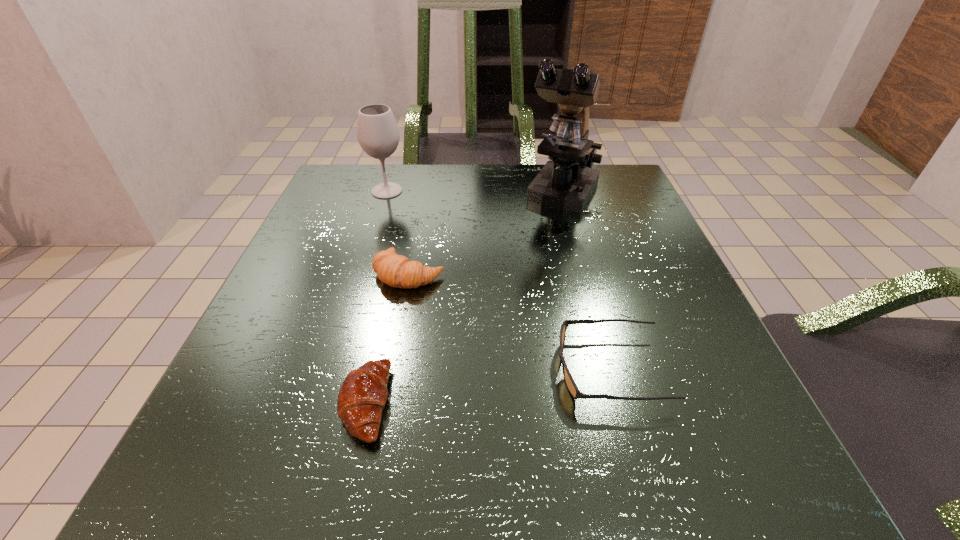
Where is `free area in between the sunglasses and the nearer crescent roll`? This screenshot has height=540, width=960. free area in between the sunglasses and the nearer crescent roll is located at coordinates (488, 386).

Locate an element on the screen. free space between the nearer crescent roll and the fourth shortest object is located at coordinates (376, 297).

Identify the location of free space between the wineglass and the nearer crescent roll. (376, 297).

This screenshot has width=960, height=540. Identify the location of unoccupied position between the sunglasses and the wineglass. (498, 280).

Where is `unoccupied area between the farther crescent roll and the nearer crescent roll`? Image resolution: width=960 pixels, height=540 pixels. unoccupied area between the farther crescent roll and the nearer crescent roll is located at coordinates (387, 339).

You are a GUI agent. You are given a task and a screenshot of the screen. Output one action in this format:
    pyautogui.click(x=<x>, y=<y>)
    Task: Click on the vacant space that's between the wineglass and the microscope
    The height and width of the screenshot is (540, 960).
    Given the screenshot: What is the action you would take?
    pyautogui.click(x=475, y=193)

Where is `free space between the shorter crescent roll and the sunglasses`? free space between the shorter crescent roll and the sunglasses is located at coordinates (488, 386).

This screenshot has height=540, width=960. I want to click on object that can be found as the closest to the farther crescent roll, so click(362, 396).

Identify which object is the fourth closest to the nearer crescent roll. Please provide its 2D coordinates. Your answer should be formatted as a tuple, i.e. [(x, y)], where the tuple contains the x and y coordinates of a point satisfying the conditions above.

[(378, 135)]

Where is `free space that satisfies the following two spatial constraints: 1. on the back side of the third nearest object; 2. on the left side of the nearer crescent roll`? The width and height of the screenshot is (960, 540). free space that satisfies the following two spatial constraints: 1. on the back side of the third nearest object; 2. on the left side of the nearer crescent roll is located at coordinates (395, 274).